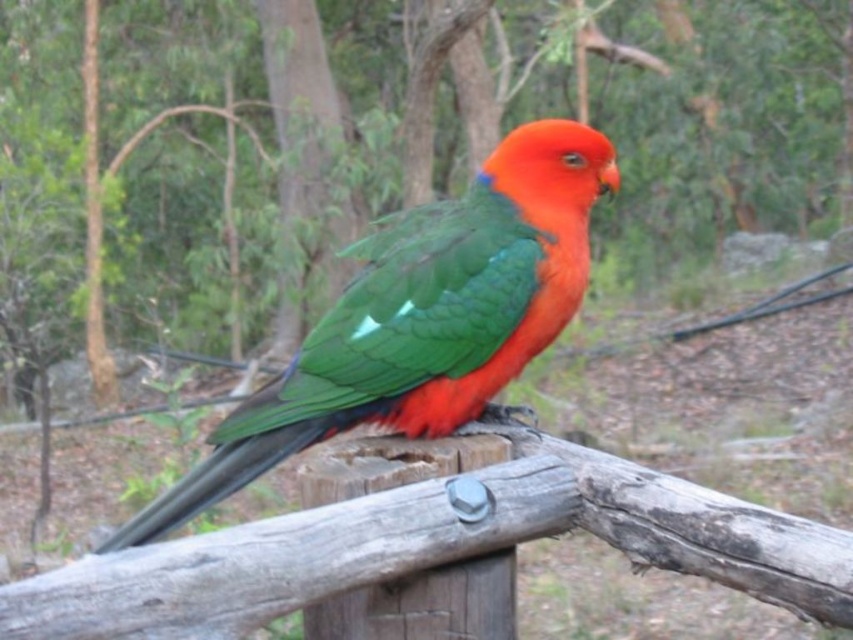
Who is shorter, wooden post at center or shiny green parrot at center?

wooden post at center

Between wooden post at center and shiny green parrot at center, which one is positioned lower?

shiny green parrot at center is lower down.

I want to click on wooden post at center, so click(x=721, y=122).